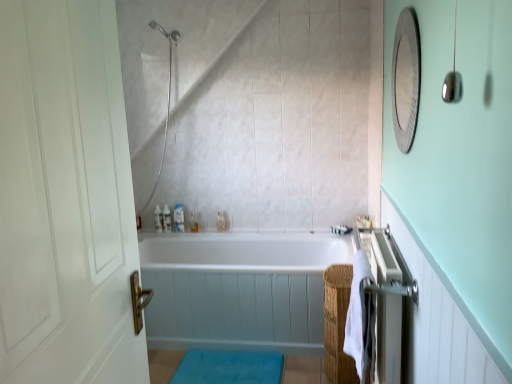
Question: Is translucent plastic bottles at upper center, positioned as the 2th toiletry in left-to-right order, positioned with its back to white glossy bottle at upper center, placed as the 3th toiletry when sorted from left to right?

Choices:
 (A) no
 (B) yes

Answer: (A)

Question: Does translucent plastic bottles at upper center, marked as the 3th toiletry in a right-to-left arrangement, have a lesser height compared to white glossy bottle at upper center, placed as the 3th toiletry when sorted from left to right?

Choices:
 (A) yes
 (B) no

Answer: (B)

Question: Is translucent plastic bottles at upper center, positioned as the 2th toiletry in left-to-right order, in front of white glossy bottle at upper center, placed as the 3th toiletry when sorted from left to right?

Choices:
 (A) yes
 (B) no

Answer: (B)

Question: Is translucent plastic bottles at upper center, marked as the 3th toiletry in a right-to-left arrangement, aimed at white glossy bottle at upper center, which ranks as the 2th toiletry in right-to-left order?

Choices:
 (A) yes
 (B) no

Answer: (B)

Question: Does translucent plastic bottles at upper center, positioned as the 2th toiletry in left-to-right order, appear on the right side of white glossy bottle at upper center, which ranks as the 2th toiletry in right-to-left order?

Choices:
 (A) no
 (B) yes

Answer: (A)

Question: In terms of height, does silver metallic towel rack at right look taller or shorter compared to translucent plastic bottle at upper center, the fourth toiletry viewed from the left?

Choices:
 (A) tall
 (B) short

Answer: (A)

Question: Considering the positions of point (380, 337) and point (218, 221), is point (380, 337) closer or farther from the camera than point (218, 221)?

Choices:
 (A) farther
 (B) closer

Answer: (B)

Question: Would you say silver metallic towel rack at right is to the left or to the right of translucent plastic bottle at upper center, the fourth toiletry viewed from the left, in the picture?

Choices:
 (A) right
 (B) left

Answer: (A)

Question: From a real-world perspective, is silver metallic towel rack at right above or below translucent plastic bottle at upper center, the fourth toiletry viewed from the left?

Choices:
 (A) below
 (B) above

Answer: (A)

Question: Does point (168, 215) appear closer or farther from the camera than point (395, 375)?

Choices:
 (A) farther
 (B) closer

Answer: (A)

Question: From a real-world perspective, is translucent plastic bottles at upper center, marked as the 3th toiletry in a right-to-left arrangement, physically located above or below silver metallic towel rack at right?

Choices:
 (A) above
 (B) below

Answer: (A)

Question: In the image, is translucent plastic bottles at upper center, positioned as the 2th toiletry in left-to-right order, positioned in front of or behind silver metallic towel rack at right?

Choices:
 (A) behind
 (B) front

Answer: (A)

Question: In terms of height, does translucent plastic bottles at upper center, marked as the 3th toiletry in a right-to-left arrangement, look taller or shorter compared to silver metallic towel rack at right?

Choices:
 (A) short
 (B) tall

Answer: (A)

Question: From their relative heights in the image, would you say white glossy bottle at upper center, placed as the 3th toiletry when sorted from left to right, is taller or shorter than silver textured mirror at upper right?

Choices:
 (A) tall
 (B) short

Answer: (B)

Question: Is point (192, 226) closer or farther from the camera than point (409, 49)?

Choices:
 (A) closer
 (B) farther

Answer: (B)